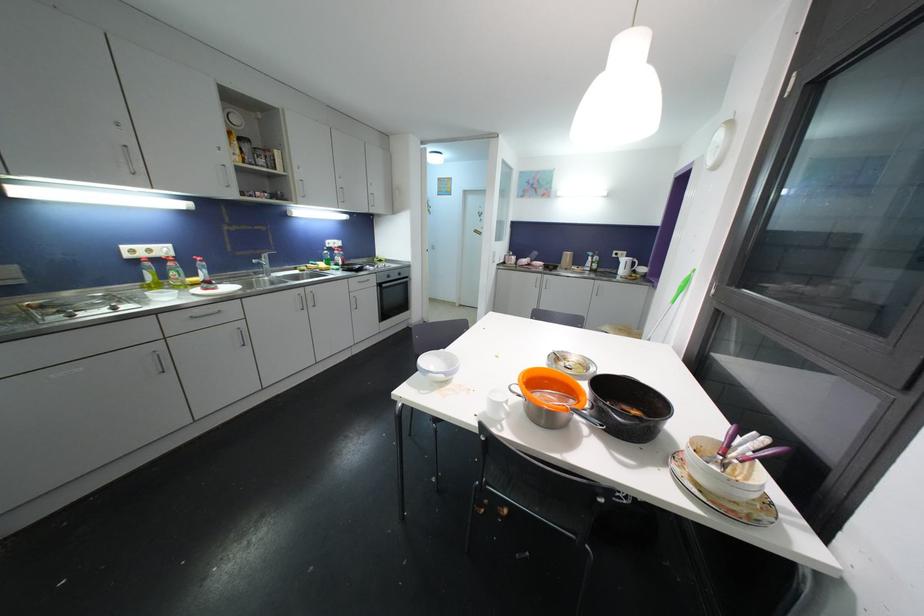
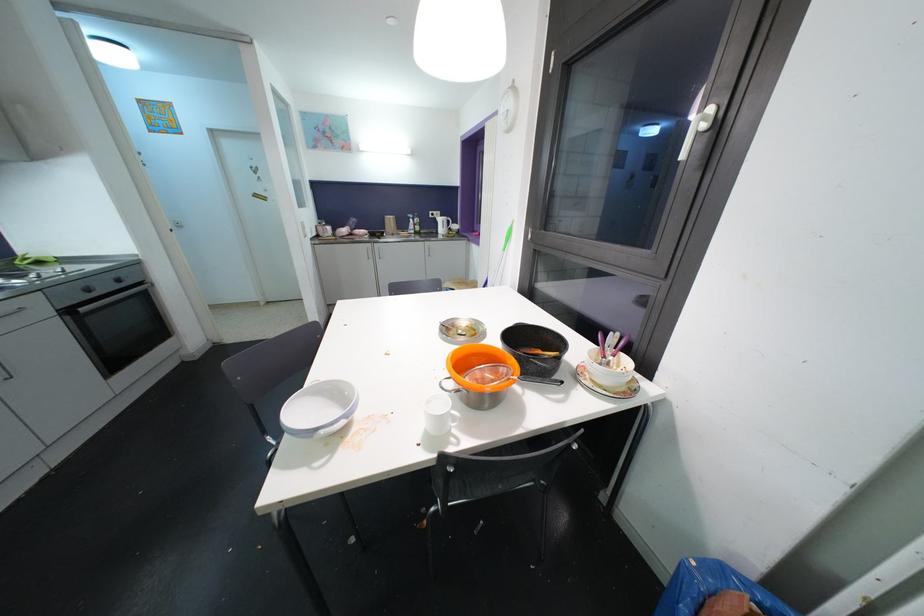
The point at (x=386, y=288) is marked in the first image. Where is the corresponding point in the second image?

(84, 312)